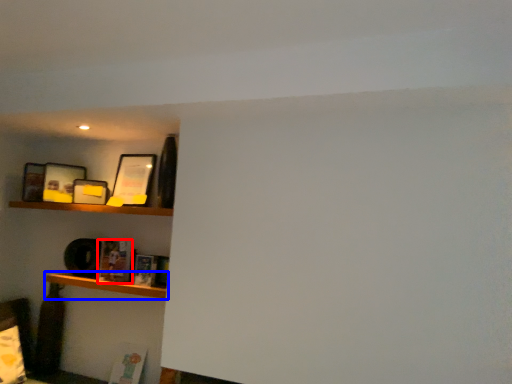
Question: Among these objects, which one is farthest to the camera, book (highlighted by a red box) or shelf (highlighted by a blue box)?

Choices:
 (A) book
 (B) shelf

Answer: (A)